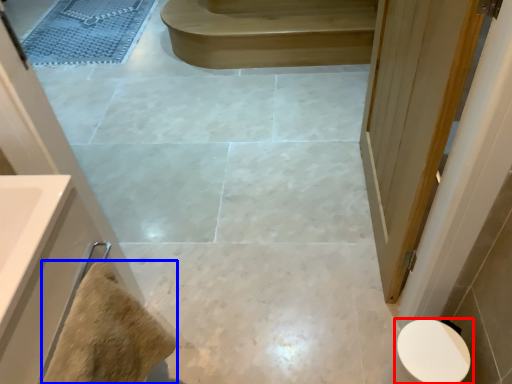
Question: Which object appears farthest to the camera in this image, toilet (highlighted by a red box) or material (highlighted by a blue box)?

Choices:
 (A) toilet
 (B) material

Answer: (A)